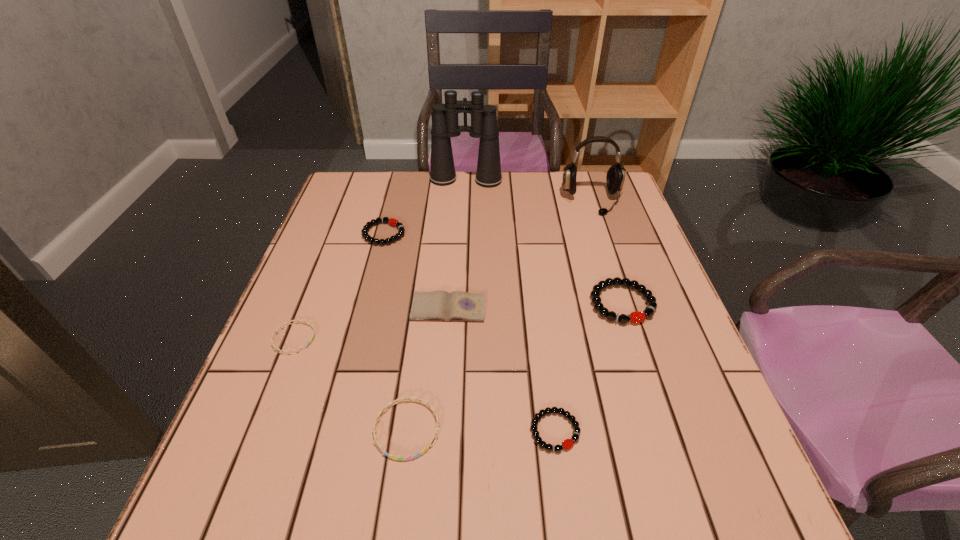
You are a GUI agent. You are given a task and a screenshot of the screen. Output one action in this format:
    pyautogui.click(x=<x>, y=<y>)
    Task: Click on the free space at the far right corner
    
    Given the screenshot: What is the action you would take?
    583,200

This screenshot has width=960, height=540. Find the location of `free space between the third bracelet from left to right and the third farthest object`. free space between the third bracelet from left to right and the third farthest object is located at coordinates (396, 332).

What are the coordinates of `free area in between the third bracelet from right to left and the seventh object from right to left` in the screenshot? It's located at (396, 332).

The width and height of the screenshot is (960, 540). I want to click on free space between the second bracelet from left to right and the tallest object, so click(x=425, y=207).

This screenshot has width=960, height=540. In order to click on empty location between the diary and the third farthest object in this screenshot , I will do `click(416, 271)`.

I want to click on vacant space that is in between the second tallest object and the binoculars, so click(529, 191).

Locate an element on the screen. This screenshot has width=960, height=540. vacant point located between the sixth object from left to right and the rightmost bracelet is located at coordinates (588, 367).

This screenshot has width=960, height=540. In order to click on vacant area between the sixth shortest object and the right blue bracelet in this screenshot , I will do `click(515, 366)`.

At what (x,y) coordinates should I click in order to perform the action: click on free spot between the diary and the leftmost bracelet. Please return your answer as a coordinate pair (x, y). Image resolution: width=960 pixels, height=540 pixels. Looking at the image, I should click on (372, 323).

You are a GUI agent. You are given a task and a screenshot of the screen. Output one action in this format:
    pyautogui.click(x=<x>, y=<y>)
    Task: Click on the empty location between the left blue bracelet and the nearer blue bracelet
    This screenshot has height=540, width=960.
    Given the screenshot: What is the action you would take?
    pyautogui.click(x=350, y=384)